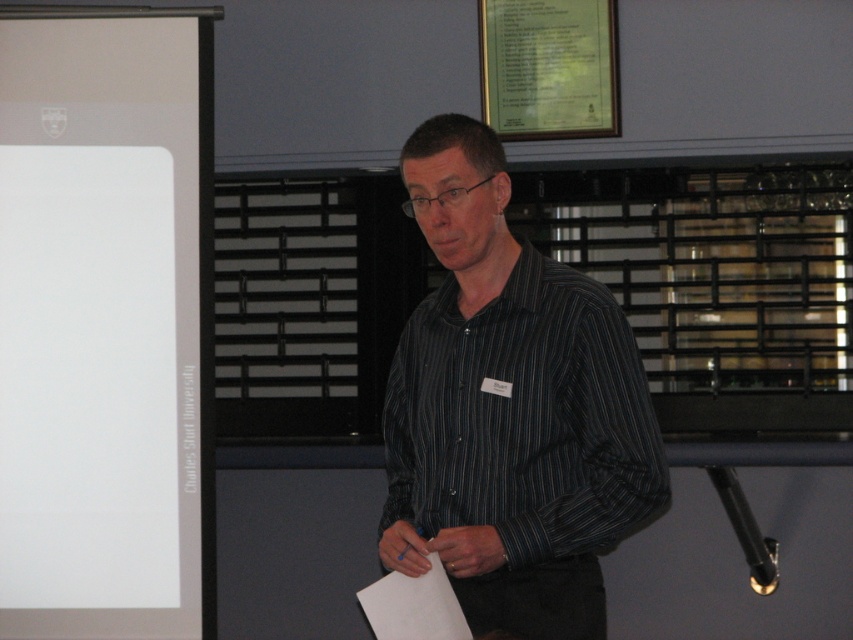
Question: Can you confirm if white matte projection screen at left is bigger than green paper at upper center?

Choices:
 (A) yes
 (B) no

Answer: (A)

Question: Which of the following is the closest to the observer?

Choices:
 (A) (457, 534)
 (B) (572, 96)

Answer: (A)

Question: Can you confirm if dark striped shirt at center is bigger than green paper at upper center?

Choices:
 (A) no
 (B) yes

Answer: (B)

Question: Which point is closer to the camera taking this photo?

Choices:
 (A) (560, 32)
 (B) (635, 394)

Answer: (B)

Question: Which of the following is the farthest from the observer?

Choices:
 (A) (195, 512)
 (B) (561, 113)

Answer: (B)

Question: Can you confirm if white matte projection screen at left is positioned to the right of dark striped shirt at center?

Choices:
 (A) no
 (B) yes

Answer: (A)